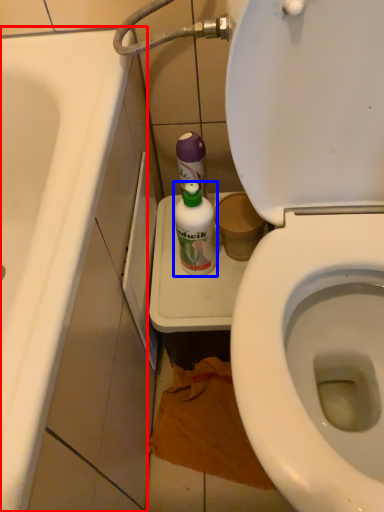
Question: Among these objects, which one is farthest to the camera, bath (highlighted by a red box) or cleaning product (highlighted by a blue box)?

Choices:
 (A) bath
 (B) cleaning product

Answer: (B)